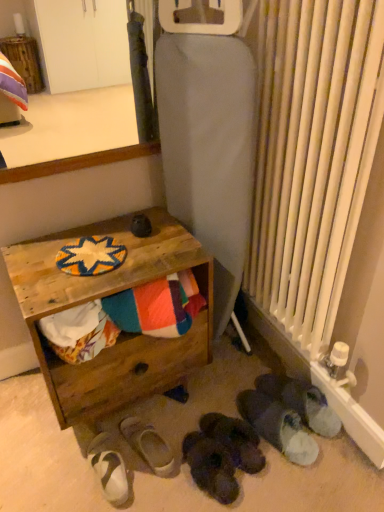
The image size is (384, 512). What are the coordinates of `vacant space behind white fuzzy slippers at lower right, which is the second footwear from right to left` in the screenshot? It's located at (238, 371).